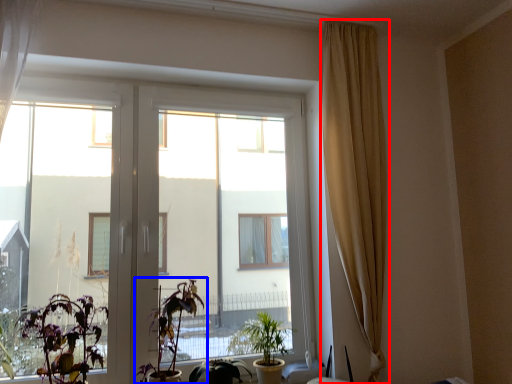
Question: Which object is further to the camera taking this photo, curtain (highlighted by a red box) or houseplant (highlighted by a blue box)?

Choices:
 (A) curtain
 (B) houseplant

Answer: (A)